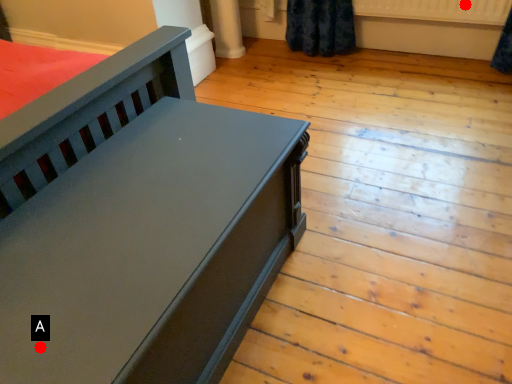
Question: Two points are circled on the image, labeled by A and B beside each circle. Which point appears farthest from the camera in this image?

Choices:
 (A) A is further
 (B) B is further

Answer: (B)